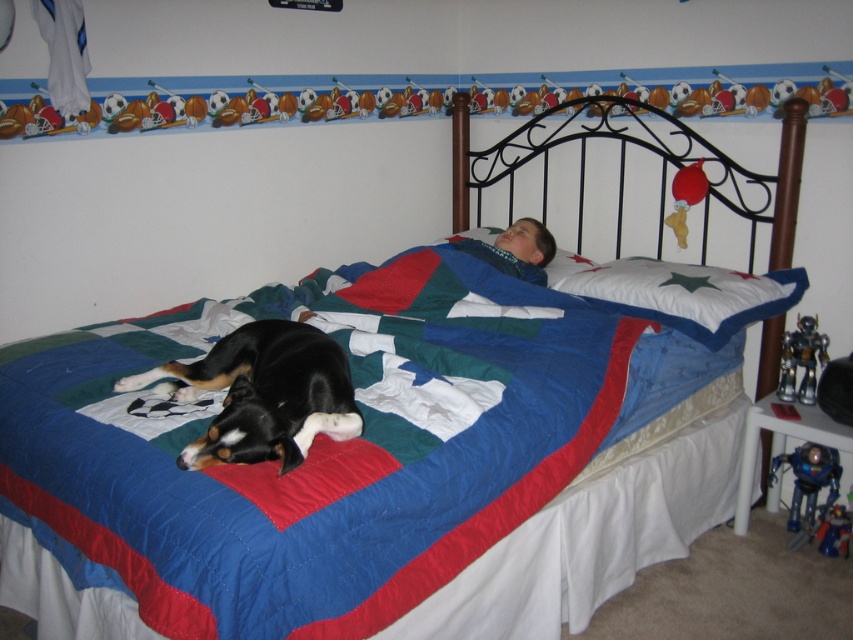
Who is more forward, (627, 292) or (675, 173)?

Positioned in front is point (627, 292).

Does white soft pillow at upper right come in front of red rubber duck at upper right?

Yes, it is in front of red rubber duck at upper right.

Which is behind, point (699, 330) or point (686, 234)?

The point (686, 234) is more distant.

You are a GUI agent. You are given a task and a screenshot of the screen. Output one action in this format:
    pyautogui.click(x=<x>, y=<y>)
    Task: Click on the white soft pillow at upper right
    This screenshot has height=640, width=853.
    Given the screenshot: What is the action you would take?
    pyautogui.click(x=688, y=294)

Which of these two, metallic silver robot at right or red rubber duck at upper right, stands taller?

Standing taller between the two is red rubber duck at upper right.

From the picture: Who is shorter, metallic silver robot at right or red rubber duck at upper right?

Standing shorter between the two is metallic silver robot at right.

What do you see at coordinates (801, 360) in the screenshot? The width and height of the screenshot is (853, 640). I see `metallic silver robot at right` at bounding box center [801, 360].

At what (x,y) coordinates should I click in order to perform the action: click on metallic silver robot at right. Please return your answer as a coordinate pair (x, y). Looking at the image, I should click on (801, 360).

Can you confirm if metallic blue robot at lower right is bigger than red rubber duck at upper right?

Indeed, metallic blue robot at lower right has a larger size compared to red rubber duck at upper right.

Based on the photo, how distant is metallic blue robot at lower right from red rubber duck at upper right?

They are 34.60 inches apart.

Locate an element on the screen. metallic blue robot at lower right is located at coordinates (809, 481).

Find the location of a particular element. metallic blue robot at lower right is located at coordinates (809, 481).